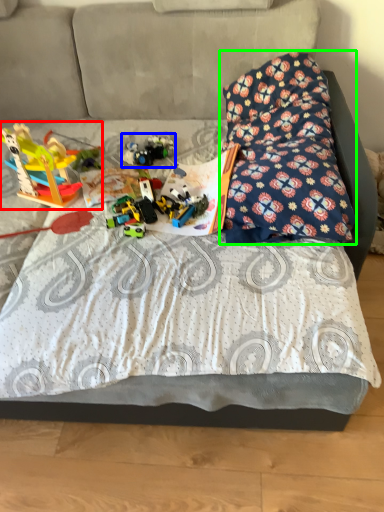
Question: Which object is the farthest from toy (highlighted by a red box)? Choose among these: toy (highlighted by a blue box) or pillow (highlighted by a green box).

Choices:
 (A) toy
 (B) pillow

Answer: (B)